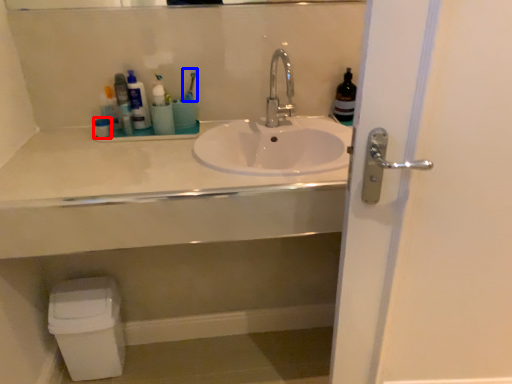
Question: Which point is further to the camera, toiletry (highlighted by a red box) or toothbrush (highlighted by a blue box)?

Choices:
 (A) toiletry
 (B) toothbrush

Answer: (B)